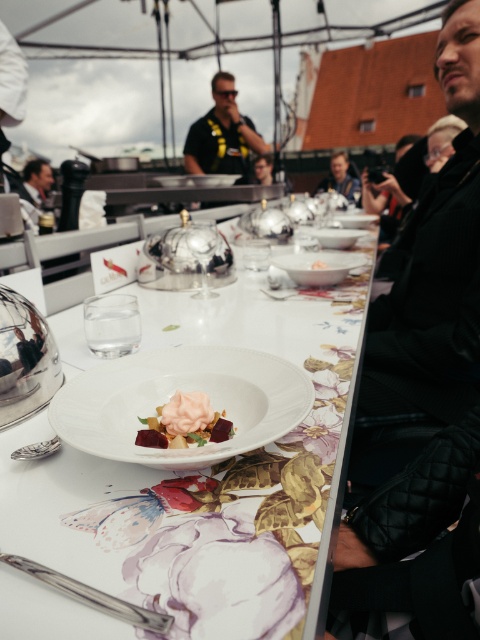
Question: Among these points, which one is nearest to the camera?

Choices:
 (A) (344, 160)
 (B) (173, 401)

Answer: (B)

Question: Is white porcelain bowl at center wider than pink creamy dessert at center?

Choices:
 (A) no
 (B) yes

Answer: (B)

Question: Does pink creamy dessert at center appear on the left side of white glossy bowl at center?

Choices:
 (A) yes
 (B) no

Answer: (A)

Question: Which object is closer to the camera taking this photo?

Choices:
 (A) white glossy bowl at center
 (B) matte black jacket at upper center
 (C) black jersey at center
 (D) white porcelain plate at center

Answer: (D)

Question: Which object is closer to the camera taking this photo?

Choices:
 (A) matte black jacket at upper left
 (B) white glossy bowl at center
 (C) black jersey at center

Answer: (B)

Question: Is pink creamy dessert at center thinner than white glossy plate at center?

Choices:
 (A) no
 (B) yes

Answer: (B)